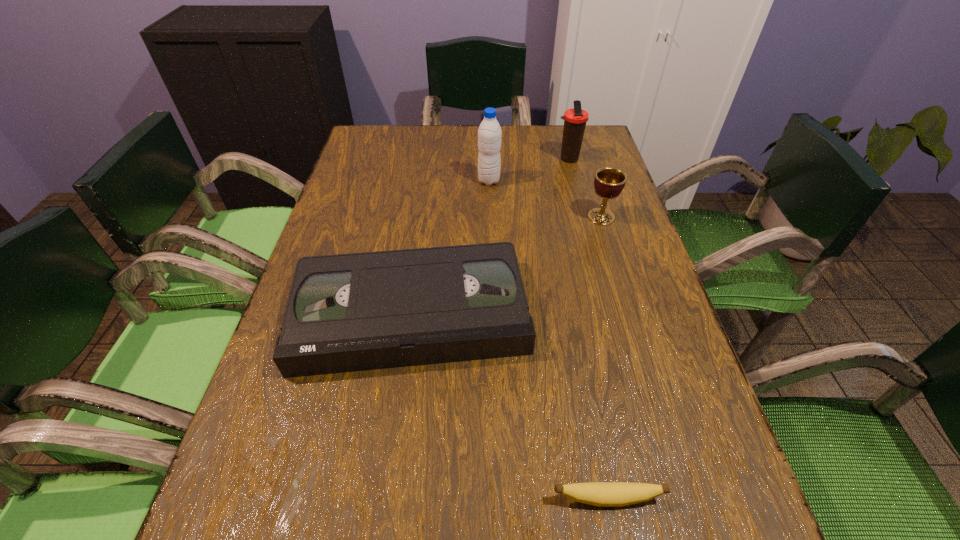
Where is `object located in the far right corner section of the desktop`? The height and width of the screenshot is (540, 960). object located in the far right corner section of the desktop is located at coordinates (575, 119).

Find the location of a particular element. Image resolution: width=960 pixels, height=540 pixels. vacant space at the far edge is located at coordinates (420, 140).

Find the location of a particular element. blank space at the left edge of the desktop is located at coordinates (264, 411).

Where is `vacant space at the right edge of the desktop`? vacant space at the right edge of the desktop is located at coordinates (626, 232).

Find the location of `blank space at the far right corner`. blank space at the far right corner is located at coordinates (558, 154).

At what (x,y) coordinates should I click in order to perform the action: click on blank region between the shortest object and the fourth shortest object. Please return your answer as a coordinate pair (x, y). The image size is (960, 540). Looking at the image, I should click on (588, 329).

In order to click on vacant space that is in between the videotape and the farthest object in this screenshot , I will do `click(490, 237)`.

This screenshot has width=960, height=540. What are the coordinates of `free area in between the chalice and the nearest object` in the screenshot? It's located at (604, 357).

Locate an element on the screen. vacant area that lies between the fourth tallest object and the banana is located at coordinates (509, 406).

Find the location of a particular element. empty space between the second shortest object and the shortest object is located at coordinates click(x=509, y=406).